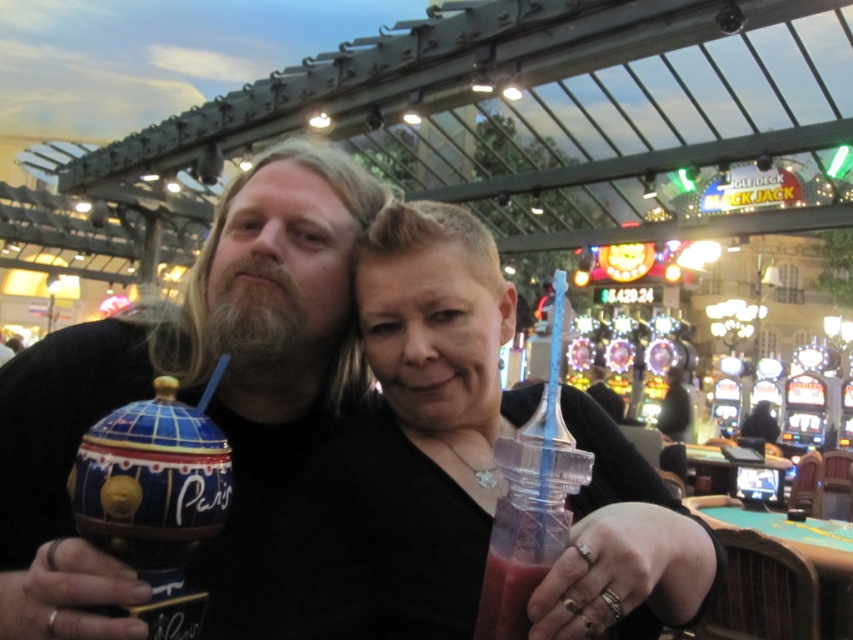
Image resolution: width=853 pixels, height=640 pixels. What do you see at coordinates (195, 392) in the screenshot?
I see `matte ceramic cup at center` at bounding box center [195, 392].

Does matte ceramic cup at center have a lesser width compared to smoothie at right?

No, matte ceramic cup at center is not thinner than smoothie at right.

What do you see at coordinates (195, 392) in the screenshot? I see `matte ceramic cup at center` at bounding box center [195, 392].

In order to click on matte ceramic cup at center in this screenshot , I will do `click(195, 392)`.